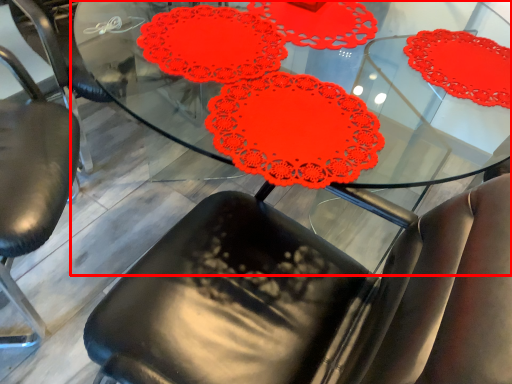
Question: Observing the image, what is the correct spatial positioning of table (annotated by the red box) in reference to chair?

Choices:
 (A) left
 (B) right

Answer: (B)